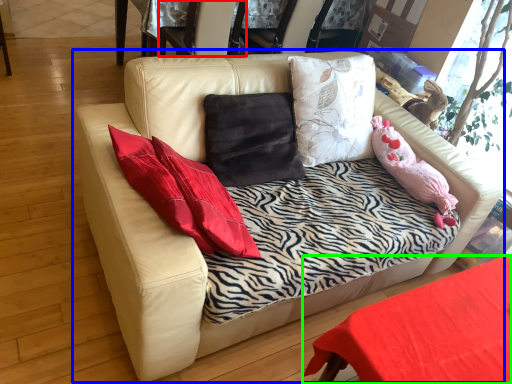
Question: Based on their relative distances, which object is nearer to armchair (highlighted by a red box)? Choose from studio couch (highlighted by a blue box) and table (highlighted by a green box).

Choices:
 (A) studio couch
 (B) table

Answer: (A)